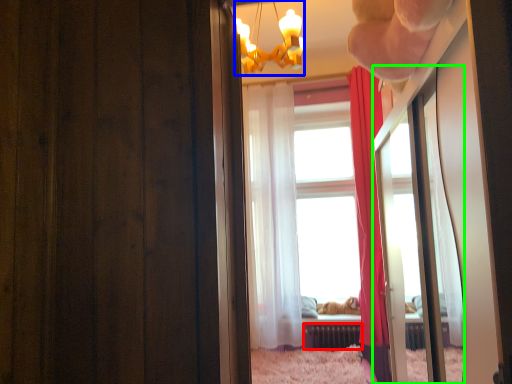
Question: Based on their relative distances, which object is nearer to radiator (highlighted by a red box)? Choose from lamp (highlighted by a blue box) and mirror (highlighted by a green box).

Choices:
 (A) lamp
 (B) mirror

Answer: (B)